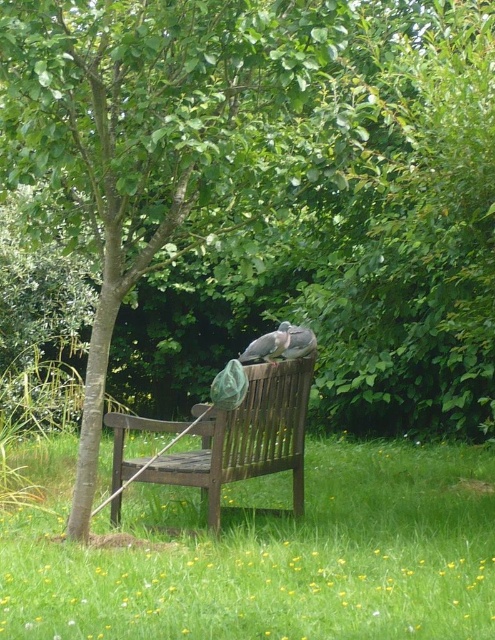
You are standing at the edge of the grassy area and see the green grass at center and the gray matte pigeon at center. Which object is positioned more to the left from your perspective?

The green grass at center is positioned to the left of the gray matte pigeon at center, so the green grass at center is more to the left.

You are a photographer aiming to capture both the gray matte pigeon at center and the gray feathered pigeon at center in a single shot. Since you want to ensure both are fully visible, which pigeon should you focus on to account for their size difference?

You should focus on the gray matte pigeon at center because it is taller than the gray feathered pigeon at center, ensuring it remains in clear view while the smaller one stays within the frame.

You are a gardener who needs to mow the lawn. The green grass at center is in the way of the wooden bench at center. How far apart are they?

The green grass at center is 38.40 inches from wooden bench at center, so they are 38.40 inches apart.